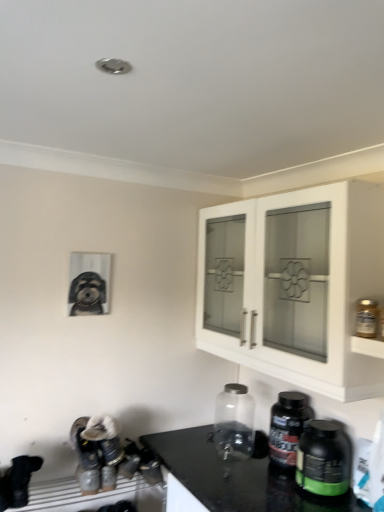
Question: Is white glass cabinet at upper right positioned with its back to matte black dog at left?

Choices:
 (A) no
 (B) yes

Answer: (A)

Question: From the image's perspective, is white glass cabinet at upper right beneath matte black dog at left?

Choices:
 (A) no
 (B) yes

Answer: (A)

Question: Is white glass cabinet at upper right positioned before matte black dog at left?

Choices:
 (A) no
 (B) yes

Answer: (B)

Question: From a real-world perspective, does white glass cabinet at upper right stand above matte black dog at left?

Choices:
 (A) no
 (B) yes

Answer: (B)

Question: Would you say white glass cabinet at upper right is outside matte black dog at left?

Choices:
 (A) no
 (B) yes

Answer: (B)

Question: Is matte black dog at left a part of white glass cabinet at upper right?

Choices:
 (A) no
 (B) yes

Answer: (A)

Question: From a real-world perspective, is black plastic bottle at lower right, the 3th bottle viewed from the front, physically above transparent glass jar at center, acting as the 1th bottle starting from the back?

Choices:
 (A) no
 (B) yes

Answer: (A)

Question: Is black plastic bottle at lower right, the 3th bottle viewed from the front, taller than transparent glass jar at center, the fourth bottle viewed from the front?

Choices:
 (A) yes
 (B) no

Answer: (B)

Question: Considering the relative sizes of black plastic bottle at lower right, the 2th bottle from the back, and transparent glass jar at center, acting as the 1th bottle starting from the back, in the image provided, is black plastic bottle at lower right, the 2th bottle from the back, wider than transparent glass jar at center, acting as the 1th bottle starting from the back,?

Choices:
 (A) yes
 (B) no

Answer: (B)

Question: Is black plastic bottle at lower right, the 2th bottle from the back, to the left of transparent glass jar at center, the fourth bottle viewed from the front, from the viewer's perspective?

Choices:
 (A) yes
 (B) no

Answer: (B)

Question: From a real-world perspective, does black plastic bottle at lower right, the 3th bottle viewed from the front, sit lower than transparent glass jar at center, the fourth bottle viewed from the front?

Choices:
 (A) no
 (B) yes

Answer: (B)

Question: Is black plastic bottle at lower right, the 2th bottle from the back, bigger than transparent glass jar at center, acting as the 1th bottle starting from the back?

Choices:
 (A) no
 (B) yes

Answer: (B)

Question: Can you confirm if transparent glass jar at center, acting as the 1th bottle starting from the back, is wider than matte black dog at left?

Choices:
 (A) yes
 (B) no

Answer: (A)